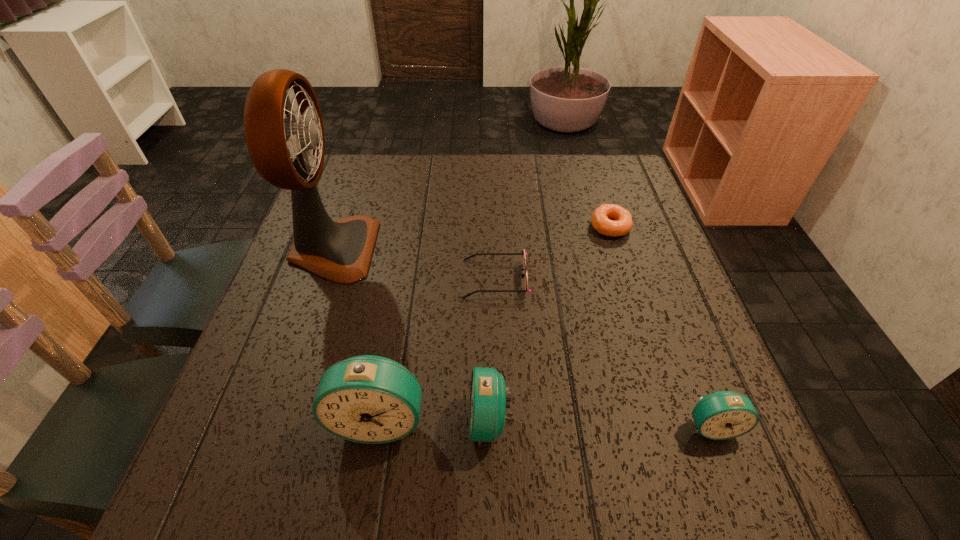
Please determine a free point for an extra alarm_clock to ensure balance. Please provide its 2D coordinates. Your answer should be formatted as a tuple, i.e. [(x, y)], where the tuple contains the x and y coordinates of a point satisfying the conditions above.

[(600, 423)]